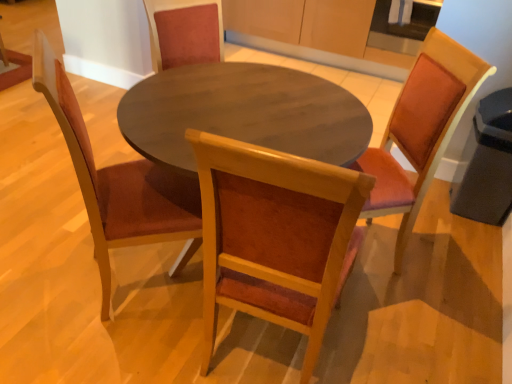
Question: Is wooden chair at left, arranged as the third chair when viewed from the right, at the right side of wooden chair at center, marked as the second chair in a right-to-left arrangement?

Choices:
 (A) no
 (B) yes

Answer: (A)

Question: Can we say wooden chair at left, which is the 1th chair in left-to-right order, lies outside wooden chair at center, marked as the second chair in a right-to-left arrangement?

Choices:
 (A) no
 (B) yes

Answer: (B)

Question: Is wooden chair at left, arranged as the third chair when viewed from the right, placed right next to wooden chair at center, the 2th chair from the left?

Choices:
 (A) yes
 (B) no

Answer: (B)

Question: From a real-world perspective, is wooden chair at left, which is the 1th chair in left-to-right order, beneath wooden chair at center, the 2th chair from the left?

Choices:
 (A) yes
 (B) no

Answer: (A)

Question: From a real-world perspective, is wooden chair at left, arranged as the third chair when viewed from the right, positioned over wooden chair at center, marked as the second chair in a right-to-left arrangement, based on gravity?

Choices:
 (A) no
 (B) yes

Answer: (A)

Question: From a real-world perspective, is wooden chair at left, which is the 1th chair in left-to-right order, positioned above or below wooden chair at right, the third chair viewed from the left?

Choices:
 (A) below
 (B) above

Answer: (B)

Question: Would you say wooden chair at left, which is the 1th chair in left-to-right order, is inside or outside wooden chair at right, the third chair viewed from the left?

Choices:
 (A) outside
 (B) inside

Answer: (A)

Question: Is wooden chair at left, which is the 1th chair in left-to-right order, to the left or to the right of wooden chair at right, the third chair viewed from the left, in the image?

Choices:
 (A) right
 (B) left

Answer: (B)

Question: From the image's perspective, relative to wooden chair at right, the third chair viewed from the left, is wooden chair at left, arranged as the third chair when viewed from the right, above or below?

Choices:
 (A) below
 (B) above

Answer: (A)

Question: Is wooden chair at right, marked as the first chair in a right-to-left arrangement, inside or outside of wooden chair at center, marked as the second chair in a right-to-left arrangement?

Choices:
 (A) inside
 (B) outside

Answer: (B)

Question: Is wooden chair at right, marked as the first chair in a right-to-left arrangement, taller or shorter than wooden chair at center, the 2th chair from the left?

Choices:
 (A) short
 (B) tall

Answer: (A)

Question: From the image's perspective, is wooden chair at right, the third chair viewed from the left, above or below wooden chair at center, marked as the second chair in a right-to-left arrangement?

Choices:
 (A) below
 (B) above

Answer: (B)

Question: In terms of size, does wooden chair at right, the third chair viewed from the left, appear bigger or smaller than wooden chair at center, the 2th chair from the left?

Choices:
 (A) big
 (B) small

Answer: (B)

Question: Is wooden chair at center, the 2th chair from the left, wider or thinner than wooden chair at right, the third chair viewed from the left?

Choices:
 (A) wide
 (B) thin

Answer: (B)

Question: Relative to wooden chair at right, marked as the first chair in a right-to-left arrangement, is wooden chair at center, marked as the second chair in a right-to-left arrangement, in front or behind?

Choices:
 (A) behind
 (B) front

Answer: (B)